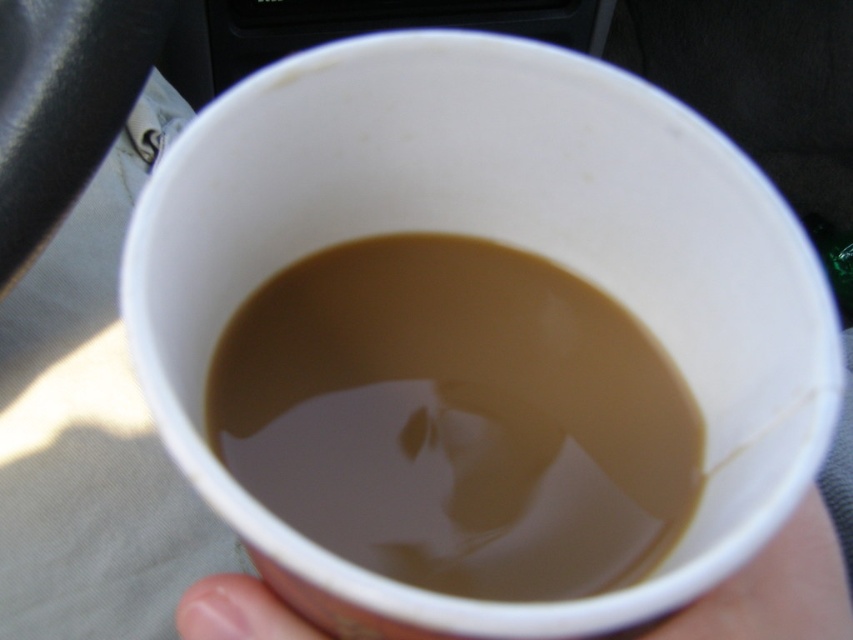
Question: Does brown matte coffee at center have a larger size compared to white paper cup at lower center?

Choices:
 (A) no
 (B) yes

Answer: (B)

Question: Where is brown matte coffee at center located in relation to white paper cup at lower center in the image?

Choices:
 (A) left
 (B) right

Answer: (A)

Question: Among these points, which one is nearest to the camera?

Choices:
 (A) (782, 586)
 (B) (445, 556)

Answer: (B)

Question: Among these points, which one is farthest from the camera?

Choices:
 (A) (805, 557)
 (B) (502, 378)

Answer: (B)

Question: Does brown matte coffee at center appear under white paper cup at lower center?

Choices:
 (A) yes
 (B) no

Answer: (B)